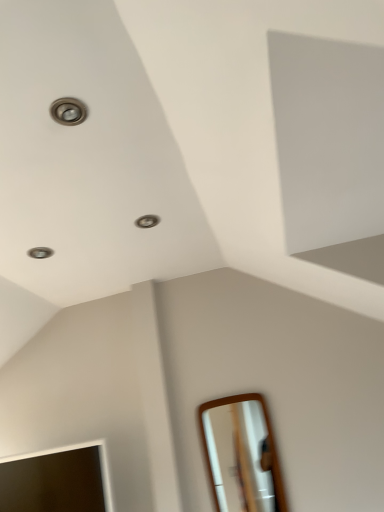
Question: Would you say white glossy mirror at lower right, marked as the first mirror in a right-to-left arrangement, is inside or outside matte wooden mirror at lower left, placed as the second mirror when sorted from right to left?

Choices:
 (A) inside
 (B) outside

Answer: (B)

Question: Is point (x=231, y=428) closer or farther from the camera than point (x=51, y=479)?

Choices:
 (A) closer
 (B) farther

Answer: (B)

Question: In terms of size, does white glossy mirror at lower right, the second mirror viewed from the left, appear bigger or smaller than matte wooden mirror at lower left, placed as the second mirror when sorted from right to left?

Choices:
 (A) big
 (B) small

Answer: (B)

Question: Considering the positions of matte wooden mirror at lower left, placed as the second mirror when sorted from right to left, and white glossy mirror at lower right, marked as the first mirror in a right-to-left arrangement, in the image, is matte wooden mirror at lower left, placed as the second mirror when sorted from right to left, taller or shorter than white glossy mirror at lower right, marked as the first mirror in a right-to-left arrangement,?

Choices:
 (A) short
 (B) tall

Answer: (A)

Question: From a real-world perspective, is matte wooden mirror at lower left, which is the first mirror in left-to-right order, positioned above or below white glossy mirror at lower right, marked as the first mirror in a right-to-left arrangement?

Choices:
 (A) above
 (B) below

Answer: (A)

Question: Relative to white glossy mirror at lower right, marked as the first mirror in a right-to-left arrangement, is matte wooden mirror at lower left, which is the first mirror in left-to-right order, in front or behind?

Choices:
 (A) front
 (B) behind

Answer: (A)

Question: Is point (1, 503) closer or farther from the camera than point (253, 421)?

Choices:
 (A) farther
 (B) closer

Answer: (B)